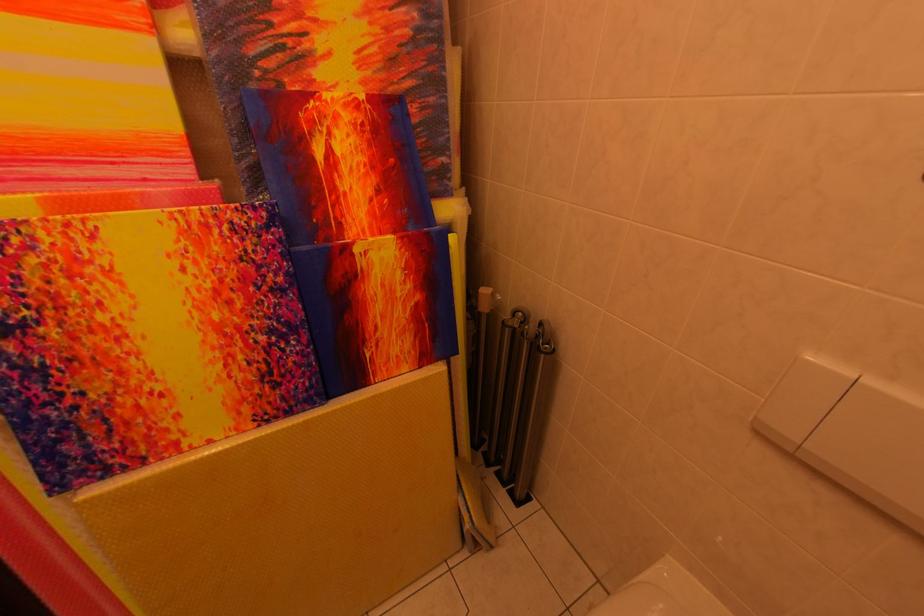
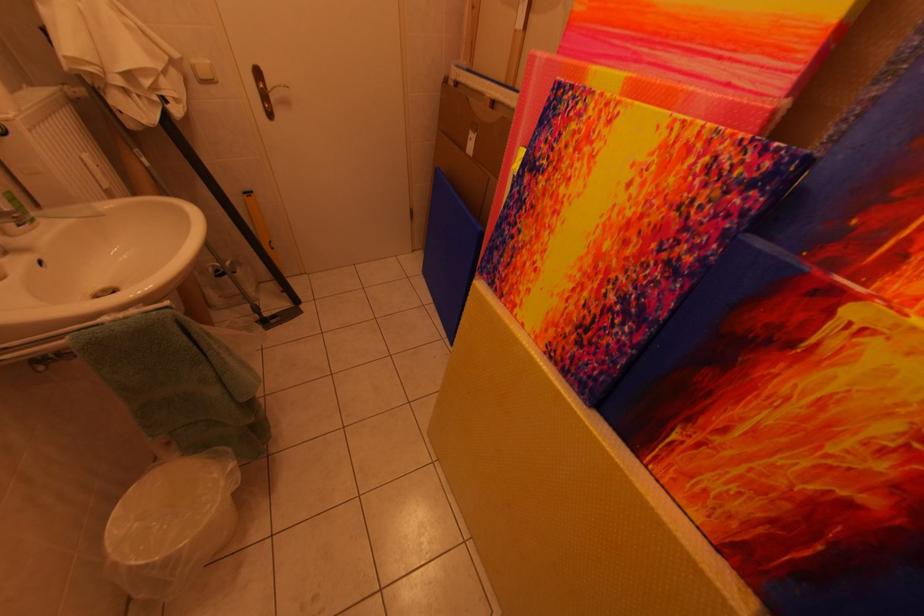
Find the pixel in the second image that matches point 132,169 in the first image.

(734, 68)